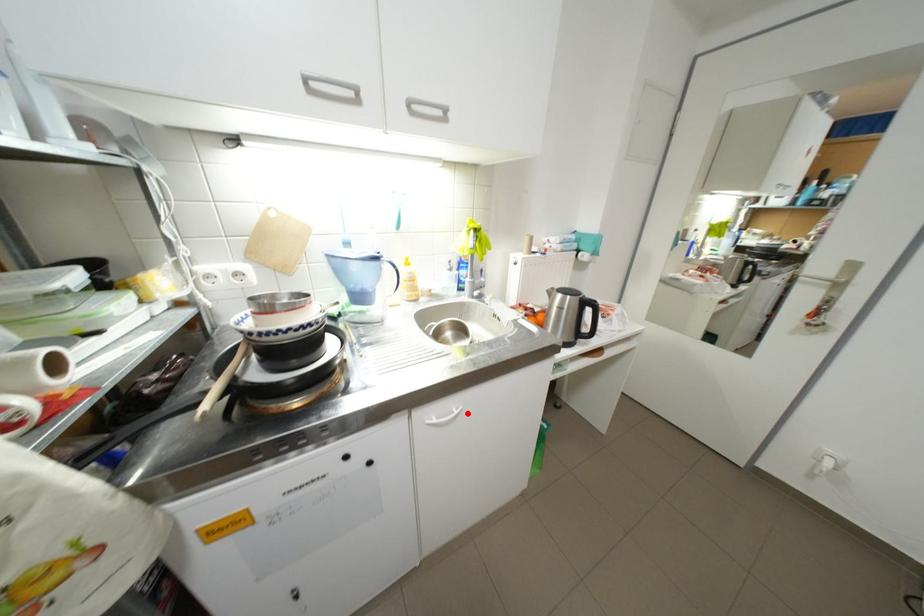
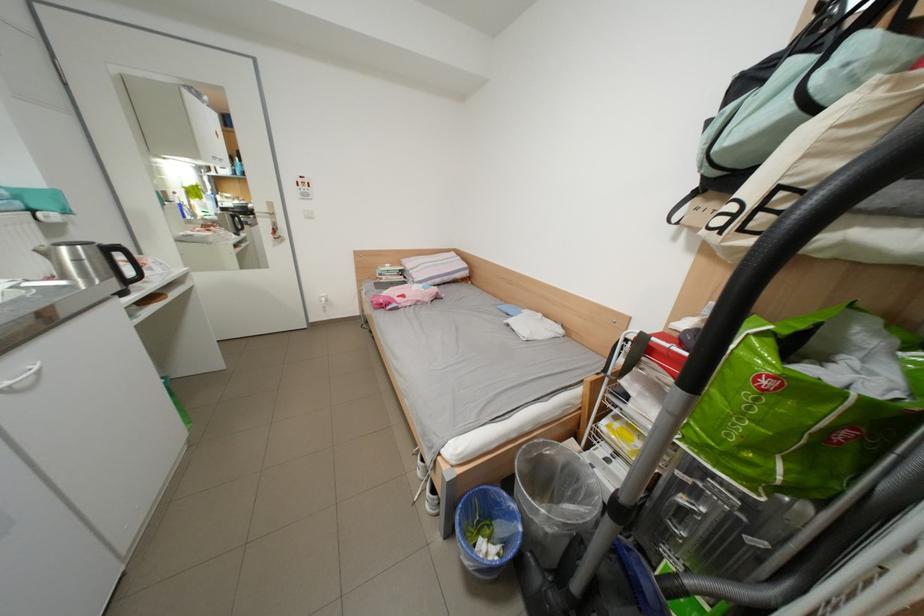
Where in the second image is the point corresponding to the highlighted location from the first image?

(46, 369)